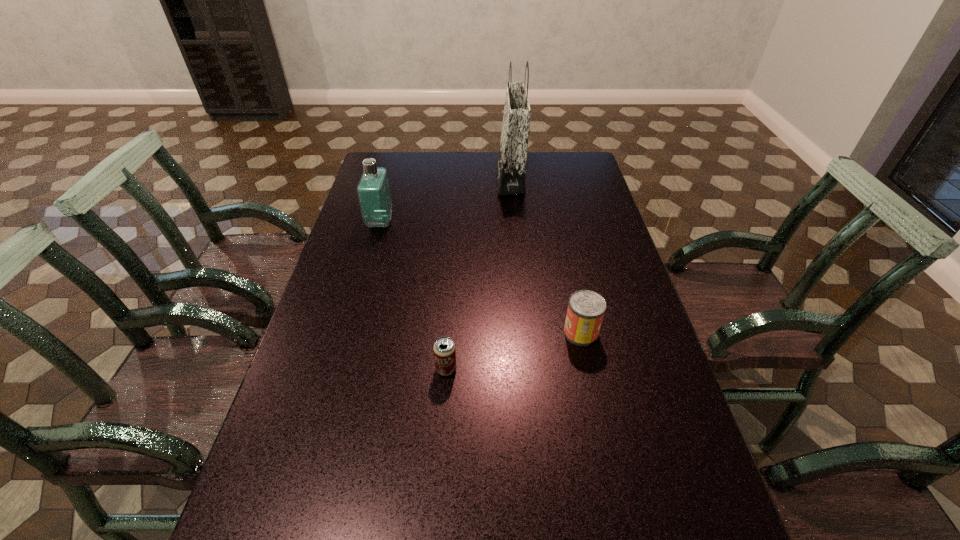
The height and width of the screenshot is (540, 960). In order to click on vacant point located between the nearest object and the leftmost object in this screenshot , I will do `click(413, 296)`.

The image size is (960, 540). Find the location of `free spot between the second nearest object and the shortest object`. free spot between the second nearest object and the shortest object is located at coordinates (514, 351).

Locate which object ranks second in proximity to the shopping bag. Please provide its 2D coordinates. Your answer should be formatted as a tuple, i.e. [(x, y)], where the tuple contains the x and y coordinates of a point satisfying the conditions above.

[(586, 308)]

Image resolution: width=960 pixels, height=540 pixels. Identify the location of object identified as the closest to the can. (444, 348).

Find the location of a particular element. vacant point that satisfies the following two spatial constraints: 1. on the front label of the leftmost object; 2. on the back side of the second nearest object is located at coordinates (349, 333).

Find the location of `vacant space that satisfies the following two spatial constraints: 1. on the back side of the can; 2. on the front of the farthest object with the design`. vacant space that satisfies the following two spatial constraints: 1. on the back side of the can; 2. on the front of the farthest object with the design is located at coordinates (547, 179).

Identify the location of vacant area in the image that satisfies the following two spatial constraints: 1. on the front label of the leftmost object; 2. on the right side of the shortest object. [339, 369].

Identify the location of vacant space that satisfies the following two spatial constraints: 1. on the front of the farthest object with the design; 2. on the back side of the second nearest object. (524, 333).

Locate an element on the screen. free space that satisfies the following two spatial constraints: 1. on the front of the rightmost object with the design; 2. on the right side of the tallest object is located at coordinates (524, 333).

Find the location of `free spot that satisfies the following two spatial constraints: 1. on the front label of the third nearest object; 2. on the left side of the rightmost object`. free spot that satisfies the following two spatial constraints: 1. on the front label of the third nearest object; 2. on the left side of the rightmost object is located at coordinates (349, 333).